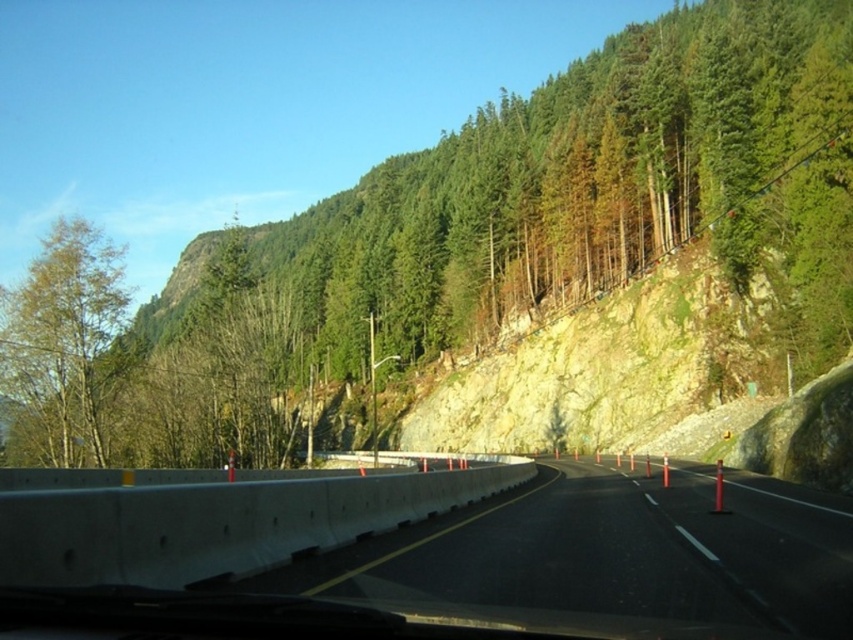
You are a passenger in the vehicle and notice the concrete barrier at center and the green matte tree at left through the window. Which object is closer to the front of the vehicle?

The concrete barrier at center is located below the green matte tree at left, meaning it is closer to the front of the vehicle.

You are a passenger in the vehicle and notice the green textured tree at upper center and the concrete barrier at center through the window. Which object is higher in the scene?

The green textured tree at upper center is higher than the concrete barrier at center in the scene.

You are a driver approaching a narrow mountain road and see the green textured tree at upper center and the green matte tree at left through the windshield. Which tree would appear closer to you based on their sizes?

The green textured tree at upper center is taller than the green matte tree at left, so even though it might be positioned higher up, its greater height could make it appear closer depending on perspective. However, without knowing their exact distances, we can only state the height difference as per the description.